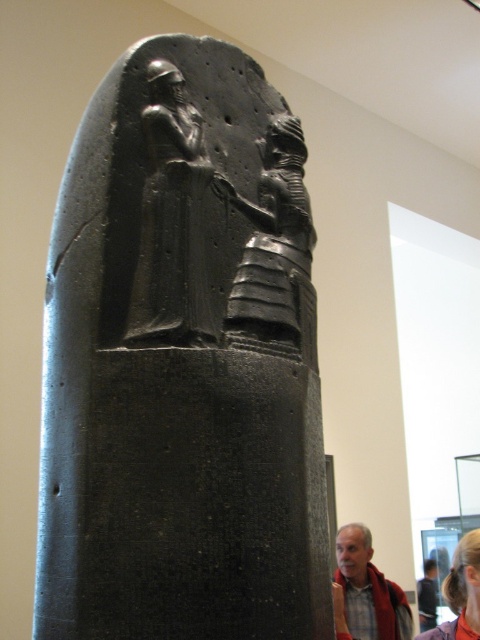
Who is positioned more to the left, black stone stele at center or blonde hair at lower right?

From the viewer's perspective, black stone stele at center appears more on the left side.

Between point (294, 120) and point (468, 592), which one is positioned behind?

Positioned behind is point (468, 592).

Where is `black stone stele at center`? The width and height of the screenshot is (480, 640). black stone stele at center is located at coordinates 182,364.

Does gray fabric jacket at lower right have a larger size compared to blonde hair at lower right?

Correct, gray fabric jacket at lower right is larger in size than blonde hair at lower right.

Is point (363, 540) closer to viewer compared to point (479, 604)?

No, (363, 540) is behind (479, 604).

Find the location of a particular element. This screenshot has width=480, height=640. gray fabric jacket at lower right is located at coordinates (365, 593).

The width and height of the screenshot is (480, 640). What are the coordinates of `gray fabric jacket at lower right` in the screenshot? It's located at (365, 593).

Which is more to the right, black stone stele at center or black stone figure at center?

From the viewer's perspective, black stone figure at center appears more on the right side.

Is black stone stele at center to the left of black stone figure at center from the viewer's perspective?

Correct, you'll find black stone stele at center to the left of black stone figure at center.

Between point (122, 161) and point (304, 188), which one is positioned in front?

Point (122, 161) is more forward.

You are a GUI agent. You are given a task and a screenshot of the screen. Output one action in this format:
    pyautogui.click(x=<x>, y=<y>)
    Task: Click on the black stone stele at center
    The height and width of the screenshot is (640, 480).
    Given the screenshot: What is the action you would take?
    click(182, 364)